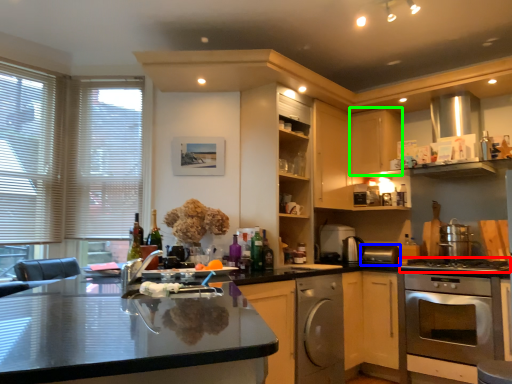
Question: Estimate the real-world distances between objects in this image. Which object is farther from gas stove (highlighted by a red box), appliance (highlighted by a blue box) or cabinetry (highlighted by a green box)?

Choices:
 (A) appliance
 (B) cabinetry

Answer: (B)